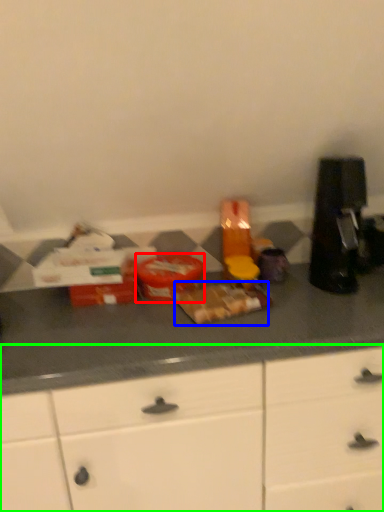
Question: Based on their relative distances, which object is farther from food (highlighted by a red box)? Choose from food (highlighted by a blue box) and cabinetry (highlighted by a green box).

Choices:
 (A) food
 (B) cabinetry

Answer: (B)